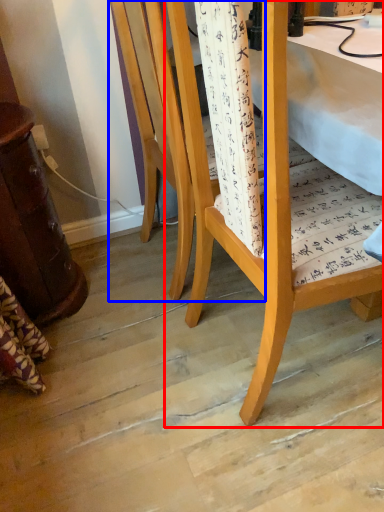
Question: Which object appears closest to the camera in this image, chair (highlighted by a red box) or chair (highlighted by a blue box)?

Choices:
 (A) chair
 (B) chair

Answer: (A)